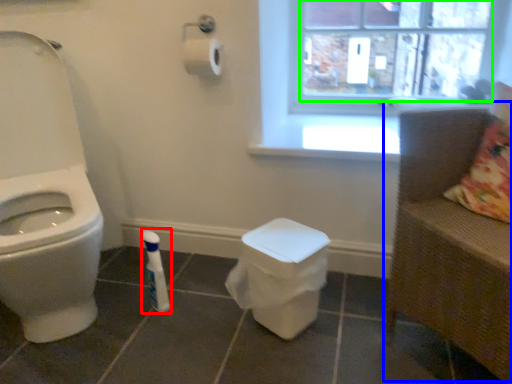
Question: Which is nearer to the toiletry (highlighted by a red box)? armchair (highlighted by a blue box) or window screen (highlighted by a green box).

Choices:
 (A) armchair
 (B) window screen

Answer: (A)